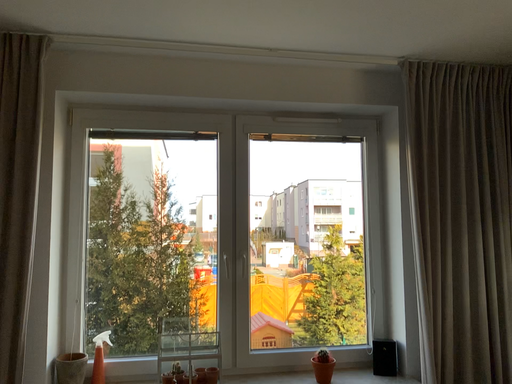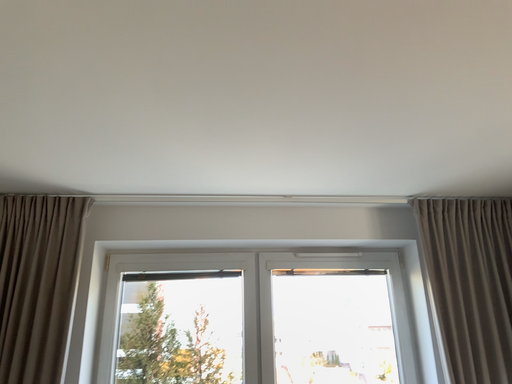
Question: How did the camera likely rotate when shooting the video?

Choices:
 (A) rotated right
 (B) rotated left

Answer: (B)